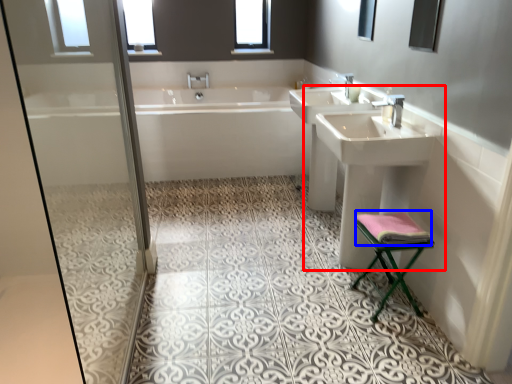
Question: Which point is further to the camera, sink (highlighted by a red box) or material (highlighted by a blue box)?

Choices:
 (A) sink
 (B) material

Answer: (A)